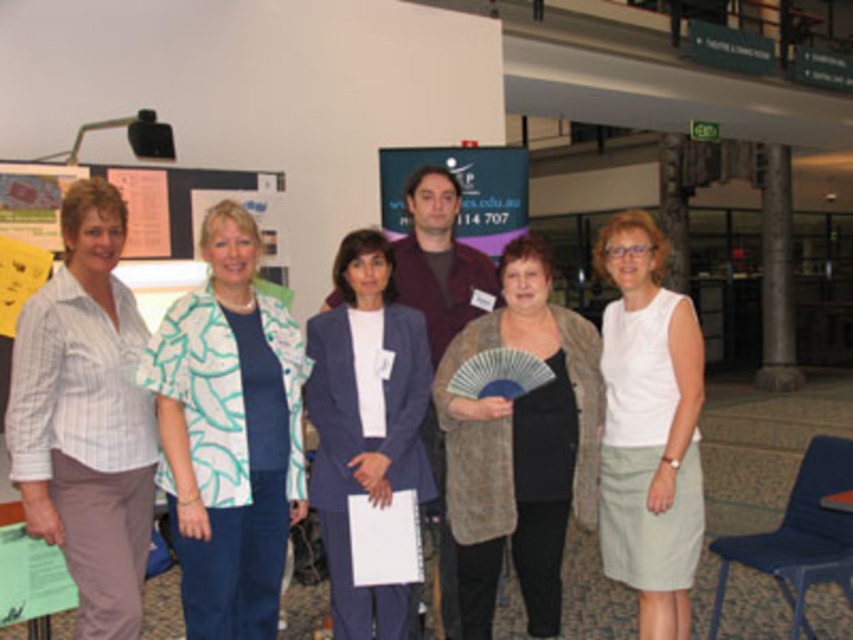
Which is in front, point (38, 394) or point (564, 330)?

Point (38, 394) is more forward.

Can you confirm if striped cotton shirt at left is bigger than beige textured cardigan at center?

Actually, striped cotton shirt at left might be smaller than beige textured cardigan at center.

Who is more distant from viewer, (74, 225) or (587, 397)?

The point (587, 397) is behind.

At what (x,y) coordinates should I click in order to perform the action: click on striped cotton shirt at left. Please return your answer as a coordinate pair (x, y). This screenshot has height=640, width=853. Looking at the image, I should click on (86, 417).

Does beige textured cardigan at center lie behind matte plastic poster at center?

No, beige textured cardigan at center is in front of matte plastic poster at center.

Between beige textured cardigan at center and matte plastic poster at center, which one has more height?

With more height is beige textured cardigan at center.

Which is behind, point (486, 516) or point (480, 227)?

The point (480, 227) is behind.

This screenshot has width=853, height=640. Find the location of `beige textured cardigan at center`. beige textured cardigan at center is located at coordinates (521, 449).

Describe the element at coordinates (229, 435) in the screenshot. This screenshot has height=640, width=853. I see `printed fabric shirt at left` at that location.

What do you see at coordinates (229, 435) in the screenshot? I see `printed fabric shirt at left` at bounding box center [229, 435].

The height and width of the screenshot is (640, 853). Identify the location of printed fabric shirt at left. (229, 435).